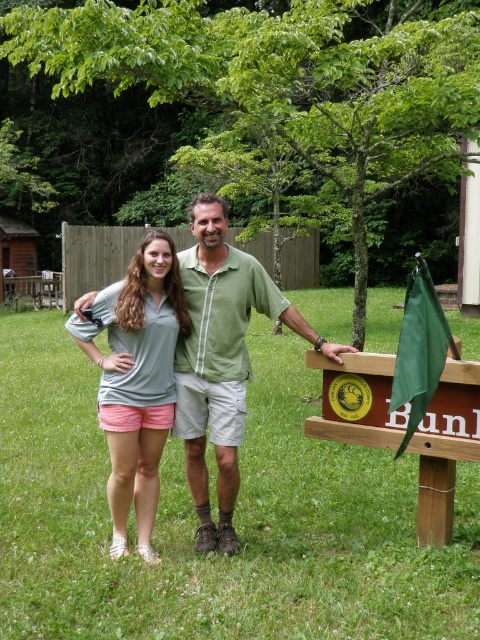
Question: Among these points, which one is farthest from the camera?

Choices:
 (A) (111, 390)
 (B) (175, 417)
 (C) (184, 502)

Answer: (C)

Question: Does green grass at center appear on the right side of matte gray shirt at center?

Choices:
 (A) yes
 (B) no

Answer: (A)

Question: Which of the following is the farthest from the observer?

Choices:
 (A) green grass at center
 (B) green matte shirt at center

Answer: (B)

Question: Is green grass at center further to the viewer compared to green matte shirt at center?

Choices:
 (A) yes
 (B) no

Answer: (B)

Question: Is green grass at center below green matte shirt at center?

Choices:
 (A) yes
 (B) no

Answer: (A)

Question: Which point appears farthest from the camera in this image?

Choices:
 (A) (144, 412)
 (B) (375, 584)

Answer: (A)